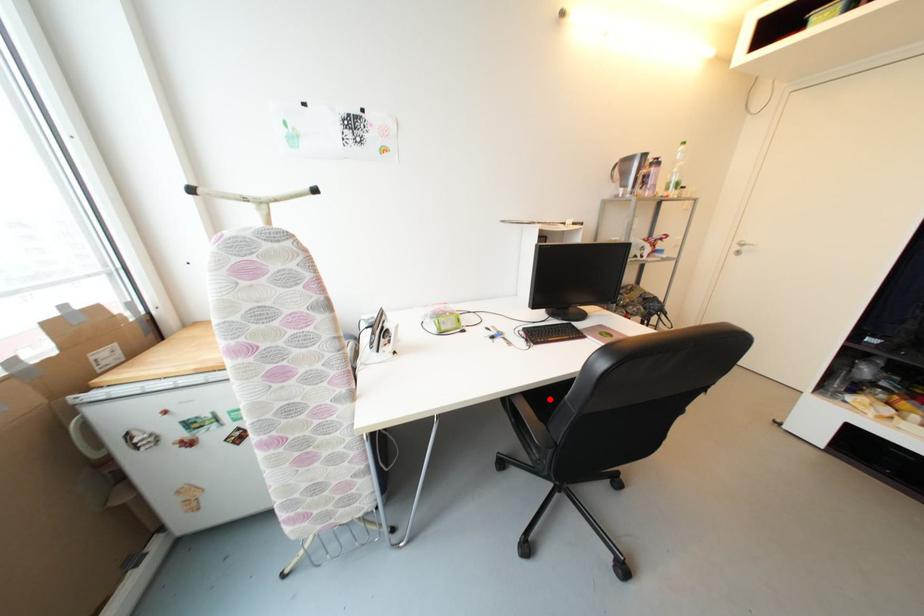
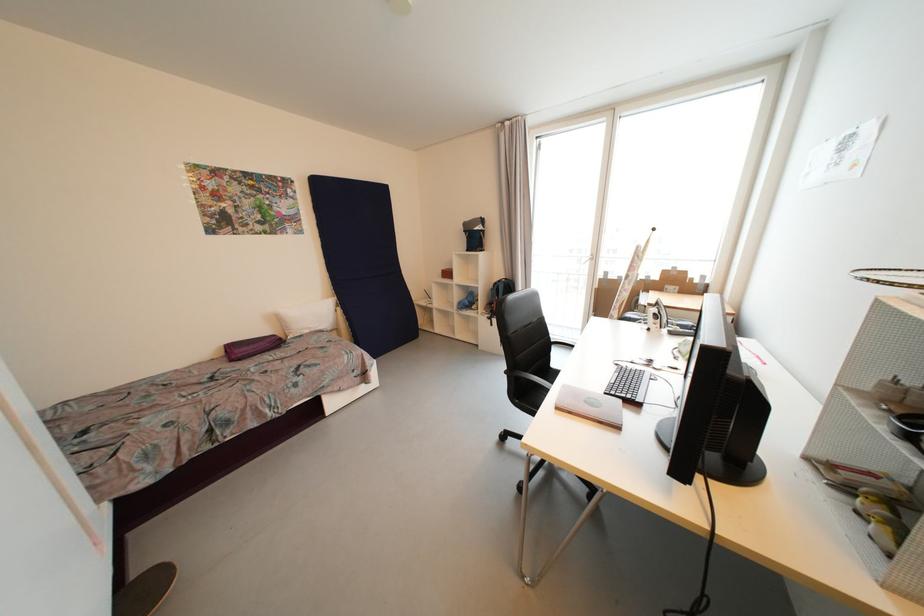
Question: I am providing you with two images of the same scene from different viewpoints. A red point is marked on the first image. Is the red point's position out of view in image 2?

Choices:
 (A) Yes
 (B) No

Answer: (A)